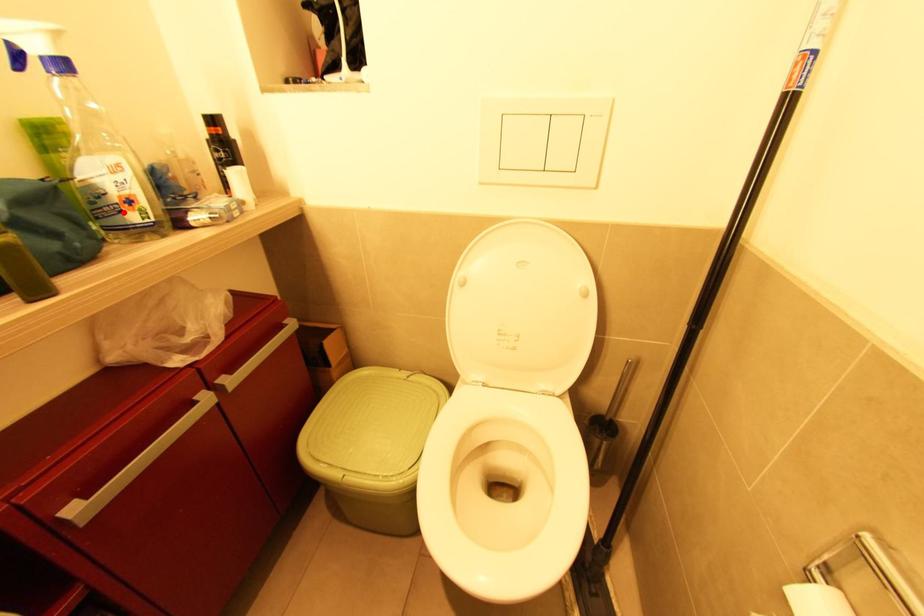
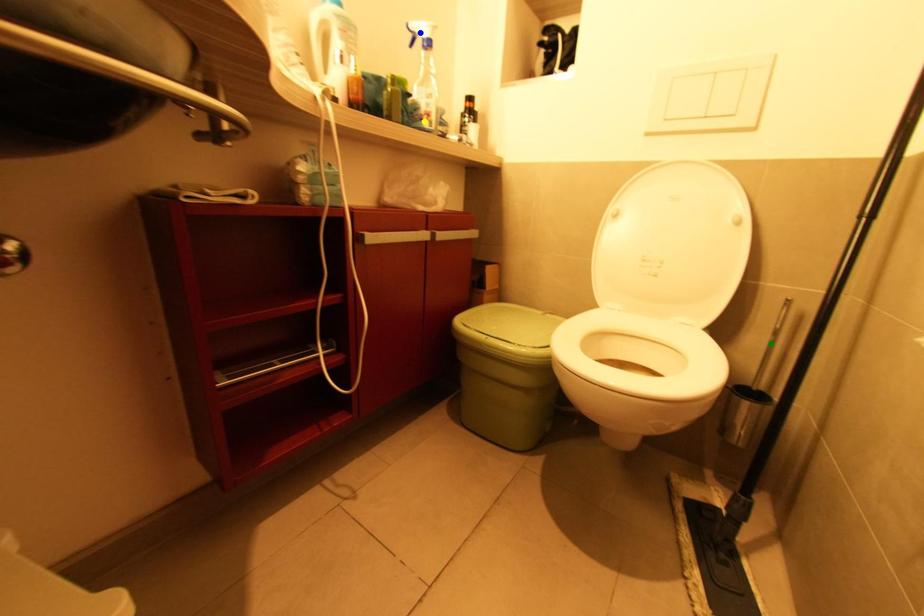
Question: I am providing you with two images of the same scene from different viewpoints. A red point is marked on the first image. You are given multiple points on the second image. Which point in image 2 is actually the same real-world point as the red point in image 1?

Choices:
 (A) yellow point
 (B) blue point
 (C) green point

Answer: (A)